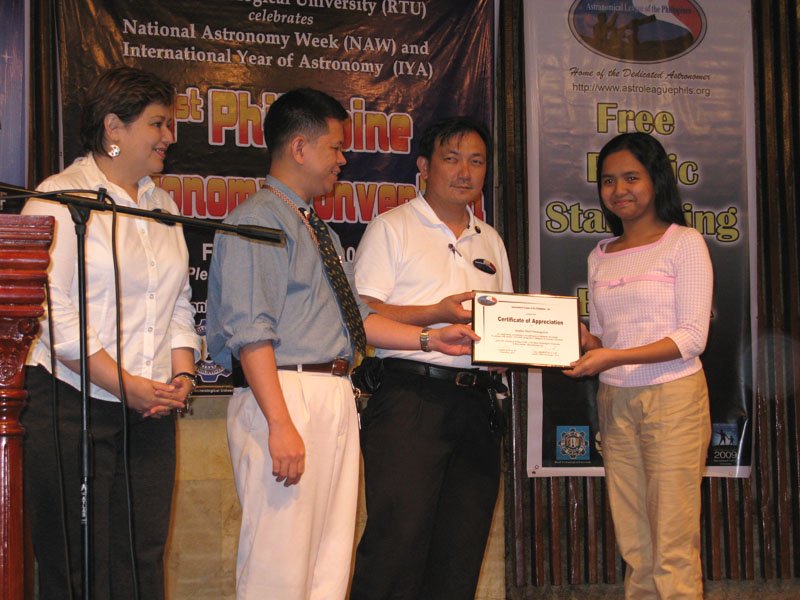
What are the coordinates of `poster big` in the screenshot? It's located at (725, 140).